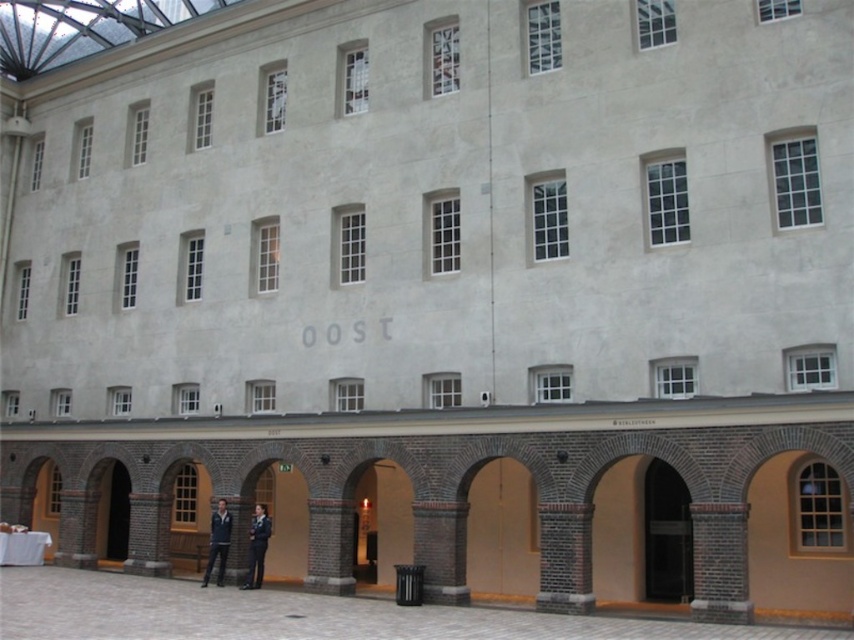
Does point (255, 568) come closer to viewer compared to point (224, 509)?

Yes, point (255, 568) is in front of point (224, 509).

Can you confirm if dark blue uniform at center is taller than dark blue jacket at center?

Incorrect, dark blue uniform at center's height is not larger of dark blue jacket at center's.

Between point (262, 508) and point (214, 557), which one is positioned in front?

Point (214, 557) is more forward.

Where is `dark blue uniform at center`? This screenshot has width=854, height=640. dark blue uniform at center is located at coordinates (256, 547).